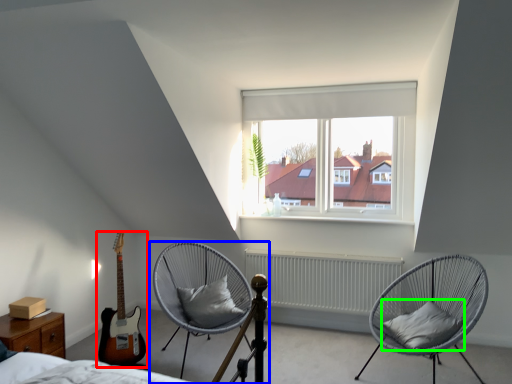
Question: Based on their relative distances, which object is farther from guitar (highlighted by a red box)? Choose from chair (highlighted by a blue box) and pillow (highlighted by a green box).

Choices:
 (A) chair
 (B) pillow

Answer: (B)